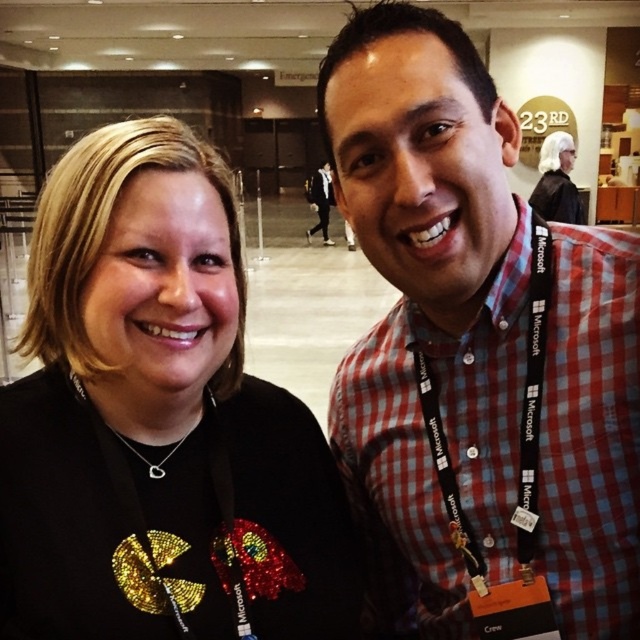
You are standing in the middle of the room and see a point marked at coordinates (429, 448). What object does this point correspond to?

The point at (429, 448) corresponds to the red checkered shirt at right.

Based on the photo, you are standing at the center of the room and want to greet the person wearing the red checkered shirt at right. In which direction should you move to reach them?

The red checkered shirt at right is positioned at point 0.700 on the x and y axes, so you should move towards the right and forward to reach them.

You are standing in the middle of the room and want to hand a document to the person wearing the black fabric lanyard at center. In which direction should you move to reach them?

The black fabric lanyard at center is located at point (x=132, y=496), so you should move towards the right and slightly forward to reach them.